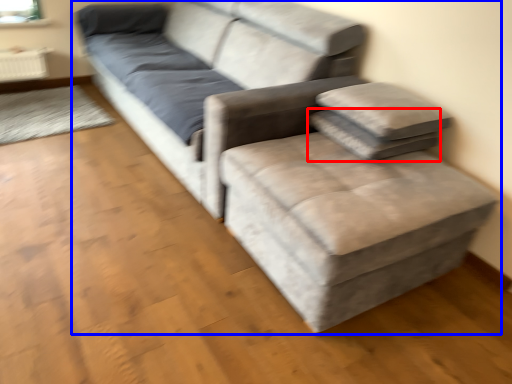
Question: Which object is further to the camera taking this photo, pillow (highlighted by a red box) or studio couch (highlighted by a blue box)?

Choices:
 (A) pillow
 (B) studio couch

Answer: (A)